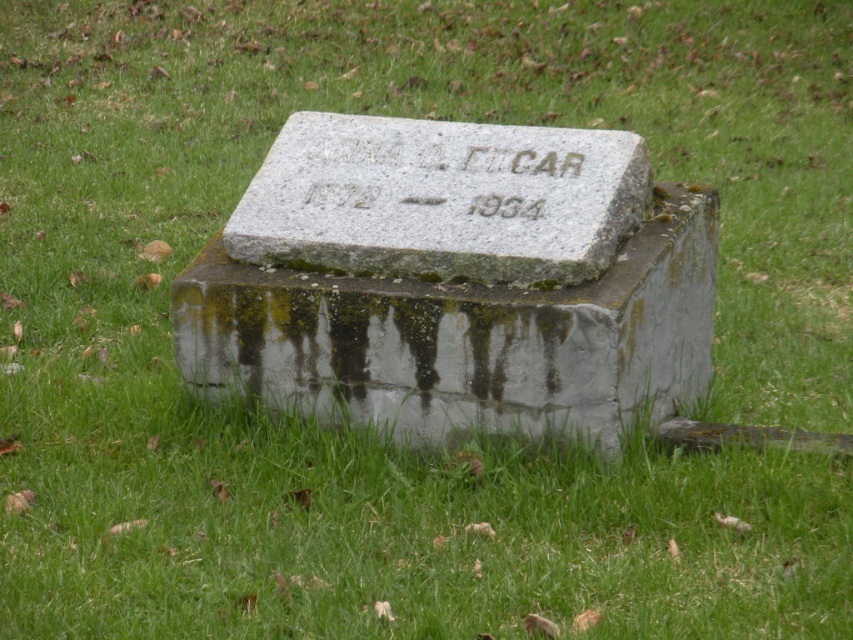
Question: Is gray stone gravestone at center behind gray stone marker at center?

Choices:
 (A) yes
 (B) no

Answer: (B)

Question: Estimate the real-world distances between objects in this image. Which object is closer to the gray stone marker at center?

Choices:
 (A) etched granite stone at center
 (B) gray stone gravestone at center

Answer: (A)

Question: Estimate the real-world distances between objects in this image. Which object is farther from the gray stone gravestone at center?

Choices:
 (A) gray stone marker at center
 (B) etched granite stone at center

Answer: (B)

Question: Does gray stone gravestone at center have a smaller size compared to etched granite stone at center?

Choices:
 (A) yes
 (B) no

Answer: (B)

Question: Which point appears farthest from the camera in this image?

Choices:
 (A) (254, 385)
 (B) (352, 170)
 (C) (428, 170)

Answer: (B)

Question: Does gray stone gravestone at center lie behind etched granite stone at center?

Choices:
 (A) no
 (B) yes

Answer: (A)